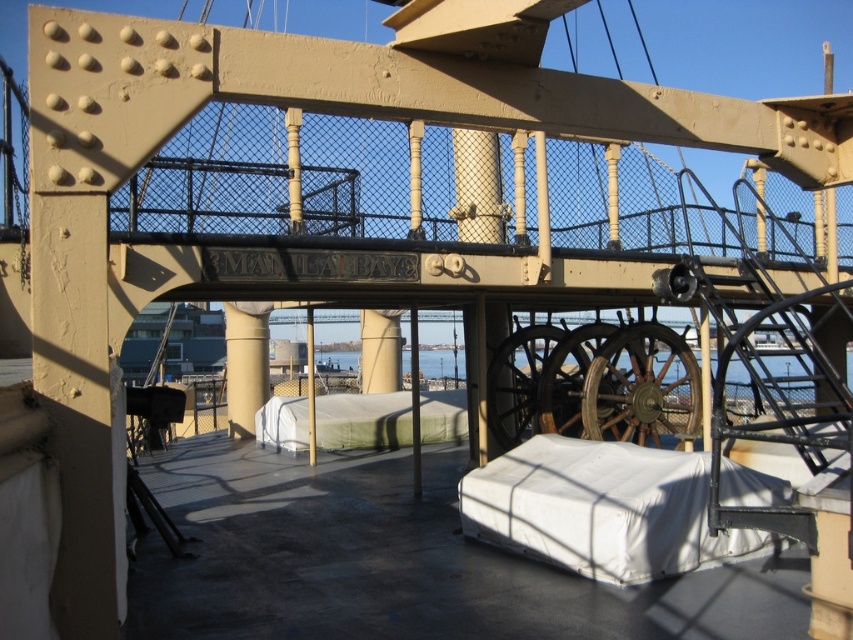
Which of these two, white fabric-covered ramp at center or metallic polished wheel at center, stands taller?

With more height is metallic polished wheel at center.

Measure the distance between white fabric-covered ramp at center and metallic polished wheel at center.

A distance of 4.26 meters exists between white fabric-covered ramp at center and metallic polished wheel at center.

The width and height of the screenshot is (853, 640). Find the location of `white fabric-covered ramp at center`. white fabric-covered ramp at center is located at coordinates (602, 509).

Which is in front, point (509, 401) or point (576, 384)?

Point (576, 384) is in front.

Between point (532, 396) and point (555, 374), which one is positioned in front?

Point (555, 374) is more forward.

The width and height of the screenshot is (853, 640). Find the location of `rustic metal ship's wheel at center`. rustic metal ship's wheel at center is located at coordinates (517, 380).

This screenshot has height=640, width=853. What are the coordinates of `white fabric-covered ramp at center` in the screenshot? It's located at (602, 509).

Who is more distant from viewer, [509,531] or [344,436]?

Point [344,436]

The image size is (853, 640). I want to click on white fabric-covered ramp at center, so click(x=602, y=509).